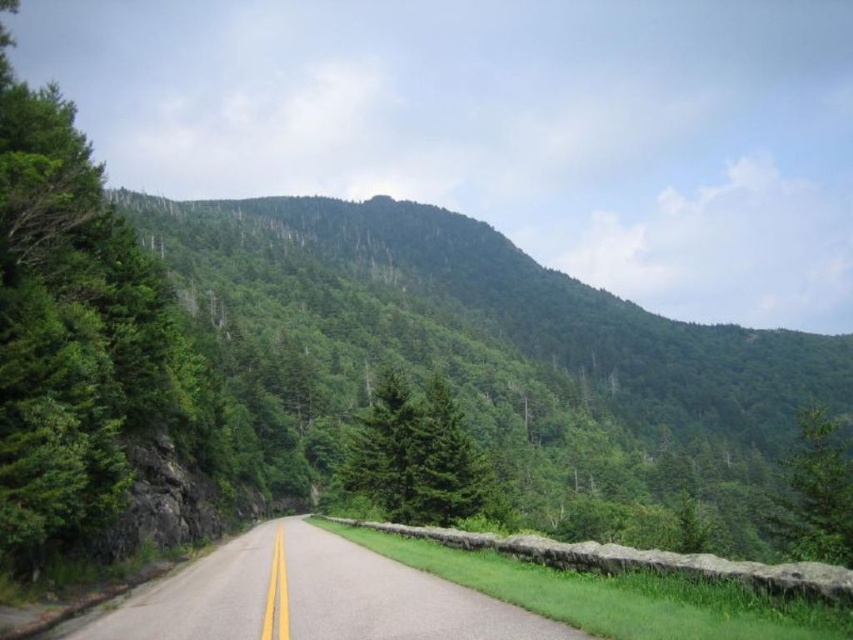
Is point (456, 477) positioned before point (819, 531)?

No.

Is point (380, 403) farther from viewer compared to point (775, 538)?

Yes, it is behind point (775, 538).

Is point (407, 522) positioned before point (782, 525)?

No, it is behind (782, 525).

Where is `green matte tree at center`? green matte tree at center is located at coordinates (413, 456).

Does point (236, 572) come farther from viewer compared to point (405, 412)?

No, it is not.

Looking at this image, which is more to the right, asphalt road at center or green matte tree at center?

asphalt road at center is more to the right.

Where is `asphalt road at center`? This screenshot has width=853, height=640. asphalt road at center is located at coordinates (312, 596).

Is asphalt road at center positioned at the back of green leafy tree at right?

No, it is in front of green leafy tree at right.

Is asphalt road at center wider than green leafy tree at right?

In fact, asphalt road at center might be narrower than green leafy tree at right.

Does point (442, 620) come farther from viewer compared to point (834, 451)?

No, it is not.

Find the location of `asphalt road at center`. asphalt road at center is located at coordinates (312, 596).